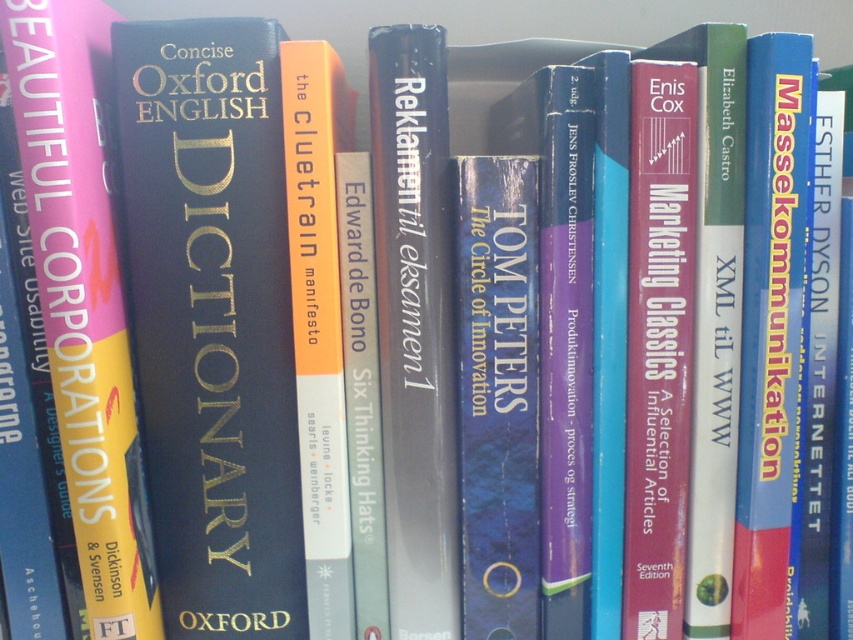
Measure the distance from matte black dictionary at center to yellow matte hardcover book at left.

A distance of 1.42 inches exists between matte black dictionary at center and yellow matte hardcover book at left.

Which is below, matte black dictionary at center or yellow matte hardcover book at left?

matte black dictionary at center is below.

The image size is (853, 640). I want to click on matte black dictionary at center, so click(212, 321).

At what (x,y) coordinates should I click in order to perform the action: click on matte black dictionary at center. Please return your answer as a coordinate pair (x, y). Image resolution: width=853 pixels, height=640 pixels. Looking at the image, I should click on (212, 321).

Does matte black dictionary at center appear on the left side of hardcover book at center?

Indeed, matte black dictionary at center is positioned on the left side of hardcover book at center.

Is point (225, 118) closer to viewer compared to point (445, 424)?

Yes, it is.

Does point (215, 589) come behind point (451, 579)?

Yes, point (215, 589) is behind point (451, 579).

I want to click on matte black dictionary at center, so click(x=212, y=321).

Is yellow matte hardcover book at left to the right of hardcover book at center from the viewer's perspective?

No, yellow matte hardcover book at left is not to the right of hardcover book at center.

In the scene shown: Does yellow matte hardcover book at left have a greater height compared to hardcover book at center?

Correct, yellow matte hardcover book at left is much taller as hardcover book at center.

Between point (41, 148) and point (415, 608), which one is positioned in front?

Positioned in front is point (41, 148).

Where is `yellow matte hardcover book at left`? Image resolution: width=853 pixels, height=640 pixels. yellow matte hardcover book at left is located at coordinates (83, 298).